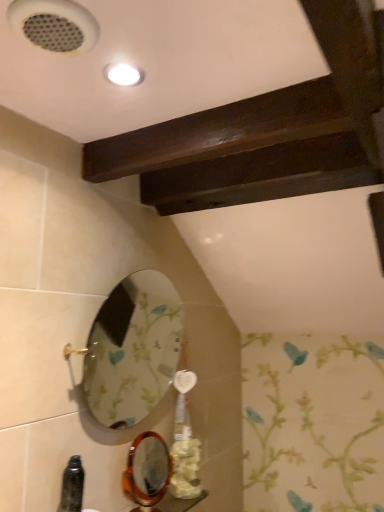
Locate an element on the screen. This screenshot has width=384, height=512. white matte flower at lower center is located at coordinates (185, 469).

Describe the element at coordinates (185, 469) in the screenshot. I see `white matte flower at lower center` at that location.

What do you see at coordinates (133, 349) in the screenshot? This screenshot has width=384, height=512. I see `oval glass mirror at lower left` at bounding box center [133, 349].

What is the approximate height of oval glass mirror at lower left?

oval glass mirror at lower left is 51.88 centimeters tall.

What are the coordinates of `oval glass mirror at lower left` in the screenshot? It's located at (133, 349).

Find the location of a particular element. The width and height of the screenshot is (384, 512). white matte flower at lower center is located at coordinates (185, 469).

Is oval glass mirror at lower left to the left or to the right of white matte flower at lower center in the image?

Based on their positions, oval glass mirror at lower left is located to the left of white matte flower at lower center.

Considering the positions of objects oval glass mirror at lower left and white matte flower at lower center in the image provided, who is behind, oval glass mirror at lower left or white matte flower at lower center?

white matte flower at lower center is further away from the camera.

Is point (135, 392) less distant than point (183, 439)?

That is False.

From the image's perspective, between oval glass mirror at lower left and white matte flower at lower center, which one is located above?

oval glass mirror at lower left is shown above in the image.

From a real-world perspective, which object rests below the other?

white matte flower at lower center is physically lower.

Is oval glass mirror at lower left wider than white matte flower at lower center?

Indeed, oval glass mirror at lower left has a greater width compared to white matte flower at lower center.

From their relative heights in the image, would you say oval glass mirror at lower left is taller or shorter than white matte flower at lower center?

In the image, oval glass mirror at lower left appears to be taller than white matte flower at lower center.

Considering the relative sizes of oval glass mirror at lower left and white matte flower at lower center in the image provided, is oval glass mirror at lower left bigger than white matte flower at lower center?

Indeed, oval glass mirror at lower left has a larger size compared to white matte flower at lower center.

Is oval glass mirror at lower left inside the boundaries of white matte flower at lower center, or outside?

oval glass mirror at lower left cannot be found inside white matte flower at lower center.

Is oval glass mirror at lower left next to white matte flower at lower center and touching it?

No.

Looking at this image, is oval glass mirror at lower left oriented towards white matte flower at lower center?

No, oval glass mirror at lower left is not aimed at white matte flower at lower center.

Where is `mirror to the left of white matte flower at lower center`? mirror to the left of white matte flower at lower center is located at coordinates 133,349.

Is white matte flower at lower center to the right of oval glass mirror at lower left from the viewer's perspective?

Yes, white matte flower at lower center is to the right of oval glass mirror at lower left.

Considering the relative positions of white matte flower at lower center and oval glass mirror at lower left in the image provided, is white matte flower at lower center in front of oval glass mirror at lower left?

No, white matte flower at lower center is further to the viewer.

Does point (182, 463) come behind point (132, 372)?

No, (182, 463) is in front of (132, 372).

From the image's perspective, who appears lower, white matte flower at lower center or oval glass mirror at lower left?

white matte flower at lower center is shown below in the image.

Based on the photo, from a real-world perspective, relative to oval glass mirror at lower left, is white matte flower at lower center vertically above or below?

From a real-world perspective, white matte flower at lower center is physically below oval glass mirror at lower left.

Considering the sizes of white matte flower at lower center and oval glass mirror at lower left in the image, is white matte flower at lower center wider or thinner than oval glass mirror at lower left?

In the image, white matte flower at lower center appears to be more narrow than oval glass mirror at lower left.

Considering the sizes of white matte flower at lower center and oval glass mirror at lower left in the image, is white matte flower at lower center taller or shorter than oval glass mirror at lower left?

Clearly, white matte flower at lower center is shorter compared to oval glass mirror at lower left.

Considering the relative sizes of white matte flower at lower center and oval glass mirror at lower left in the image provided, is white matte flower at lower center bigger than oval glass mirror at lower left?

Actually, white matte flower at lower center might be smaller than oval glass mirror at lower left.

Is oval glass mirror at lower left surrounded by white matte flower at lower center?

Actually, oval glass mirror at lower left is outside white matte flower at lower center.

Would you say white matte flower at lower center is a long distance from oval glass mirror at lower left?

No, there isn't a large distance between white matte flower at lower center and oval glass mirror at lower left.

Is white matte flower at lower center looking in the opposite direction of oval glass mirror at lower left?

That's not correct — white matte flower at lower center is not looking away from oval glass mirror at lower left.

Can you tell me how much white matte flower at lower center and oval glass mirror at lower left differ in facing direction?

The angle between the facing direction of white matte flower at lower center and the facing direction of oval glass mirror at lower left is 44.4 degrees.

The height and width of the screenshot is (512, 384). In order to click on mirror in front of the white matte flower at lower center in this screenshot , I will do `click(133, 349)`.

The image size is (384, 512). Find the location of `mirror above the white matte flower at lower center (from the image's perspective)`. mirror above the white matte flower at lower center (from the image's perspective) is located at coordinates coord(133,349).

This screenshot has height=512, width=384. Find the location of `flower located behind the oval glass mirror at lower left`. flower located behind the oval glass mirror at lower left is located at coordinates (185, 469).